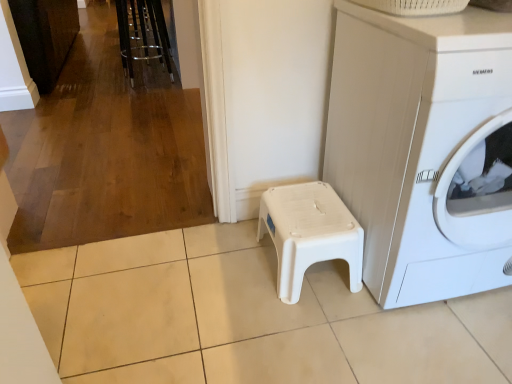
Question: Should I look upward or downward to see white plastic washing machine at lower right?

Choices:
 (A) down
 (B) up

Answer: (B)

Question: Is white plastic stool at center bigger than metallic chrome bar stool at upper left?

Choices:
 (A) no
 (B) yes

Answer: (A)

Question: Can you confirm if white plastic stool at center is shorter than metallic chrome bar stool at upper left?

Choices:
 (A) yes
 (B) no

Answer: (A)

Question: Does white plastic stool at center lie in front of metallic chrome bar stool at upper left?

Choices:
 (A) no
 (B) yes

Answer: (B)

Question: Could you tell me if white plastic stool at center is facing metallic chrome bar stool at upper left?

Choices:
 (A) no
 (B) yes

Answer: (A)

Question: Is white plastic stool at center further to the viewer compared to metallic chrome bar stool at upper left?

Choices:
 (A) yes
 (B) no

Answer: (B)

Question: Can you confirm if white plastic stool at center is taller than metallic chrome bar stool at upper left?

Choices:
 (A) yes
 (B) no

Answer: (B)

Question: From the image's perspective, would you say white plastic washing machine at lower right is positioned over metallic chrome bar stool at upper left?

Choices:
 (A) yes
 (B) no

Answer: (B)

Question: Considering the relative positions of white plastic washing machine at lower right and metallic chrome bar stool at upper left in the image provided, is white plastic washing machine at lower right to the left of metallic chrome bar stool at upper left from the viewer's perspective?

Choices:
 (A) yes
 (B) no

Answer: (B)

Question: Could you tell me if white plastic washing machine at lower right is facing metallic chrome bar stool at upper left?

Choices:
 (A) no
 (B) yes

Answer: (A)

Question: Is white plastic washing machine at lower right shorter than metallic chrome bar stool at upper left?

Choices:
 (A) no
 (B) yes

Answer: (A)

Question: Is white plastic washing machine at lower right looking in the opposite direction of metallic chrome bar stool at upper left?

Choices:
 (A) no
 (B) yes

Answer: (B)

Question: Is white plastic washing machine at lower right located outside metallic chrome bar stool at upper left?

Choices:
 (A) no
 (B) yes

Answer: (B)

Question: Is white plastic washing machine at lower right taller than white plastic stool at center?

Choices:
 (A) yes
 (B) no

Answer: (A)